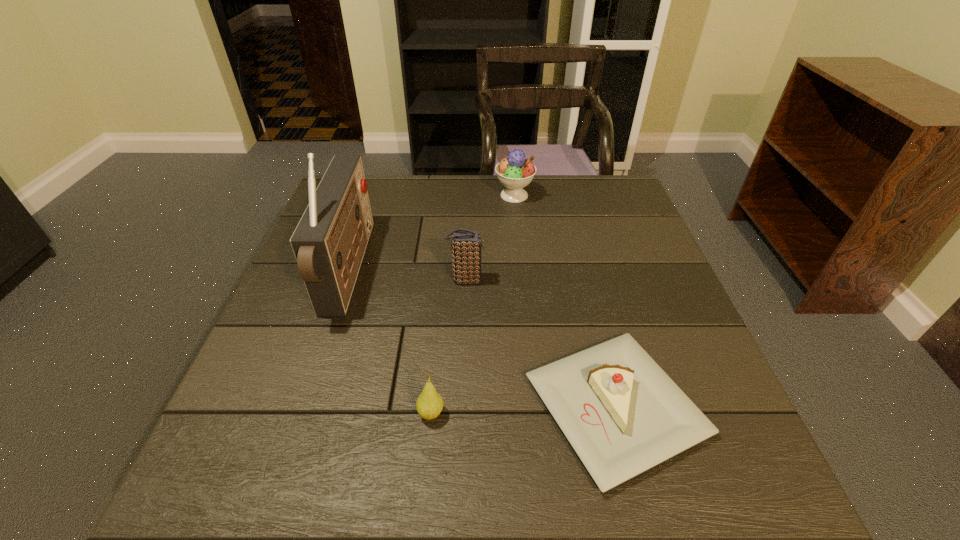
The width and height of the screenshot is (960, 540). Find the location of `the tallest object`. the tallest object is located at coordinates pyautogui.click(x=329, y=242).

You are a GUI agent. You are given a task and a screenshot of the screen. Output one action in this format:
    pyautogui.click(x=<x>, y=<y>)
    Task: Click on the radio receiver
    This screenshot has height=540, width=960.
    Given the screenshot: What is the action you would take?
    pyautogui.click(x=329, y=242)

The width and height of the screenshot is (960, 540). Identify the location of icecream. [x=515, y=172].

At what (x,y) coordinates should I click in order to perform the action: click on clutch bag. Please return your answer as a coordinate pair (x, y). Looking at the image, I should click on (466, 245).

Image resolution: width=960 pixels, height=540 pixels. Identify the location of the fourth tallest object. (429, 405).

Where is `cake`? The width and height of the screenshot is (960, 540). cake is located at coordinates (622, 414).

This screenshot has width=960, height=540. I want to click on vacant space located 0.070m on the front panel of the radio receiver, so click(x=393, y=270).

This screenshot has height=540, width=960. I want to click on free space located on the right of the farthest object, so click(x=576, y=195).

Locate an element on the screen. Image resolution: width=960 pixels, height=540 pixels. vacant space located 0.370m with the zip open on the clutch bag is located at coordinates (636, 280).

The width and height of the screenshot is (960, 540). I want to click on free space located on the left of the pear, so click(385, 414).